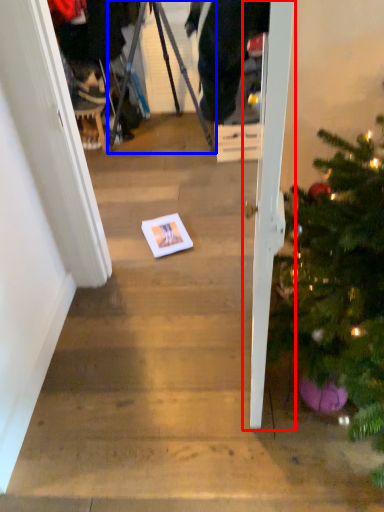
Question: Among these objects, which one is farthest to the camera, door (highlighted by a red box) or tripod (highlighted by a blue box)?

Choices:
 (A) door
 (B) tripod

Answer: (B)